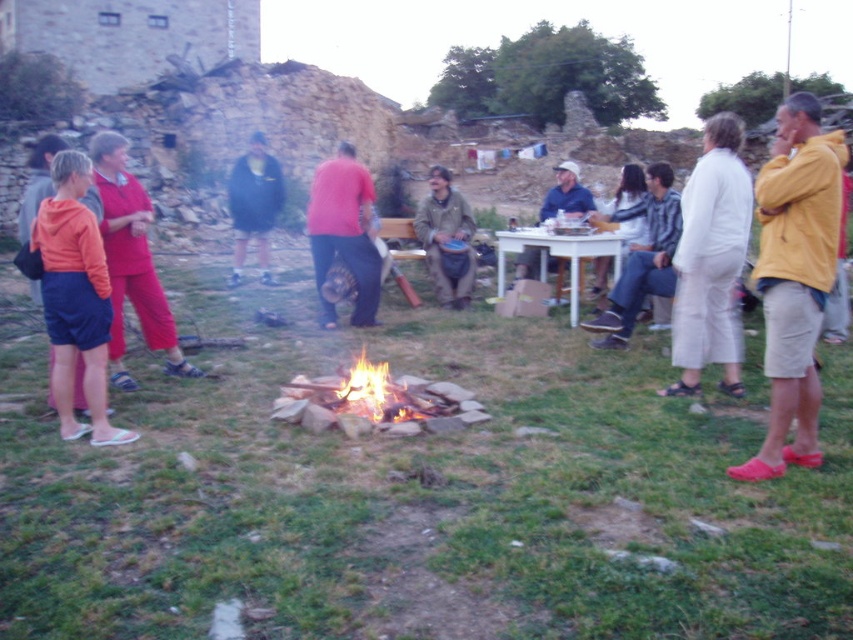
In the scene shown: You are a photographer standing at the edge of the gathering. You need to capture a photo that includes both the white cotton pants at center and orange fabric shorts at lower left. Which object should be placed higher in the frame to ensure both are visible?

The white cotton pants at center should be placed higher in the frame since it is much taller than the orange fabric shorts at lower left, ensuring both are visible.